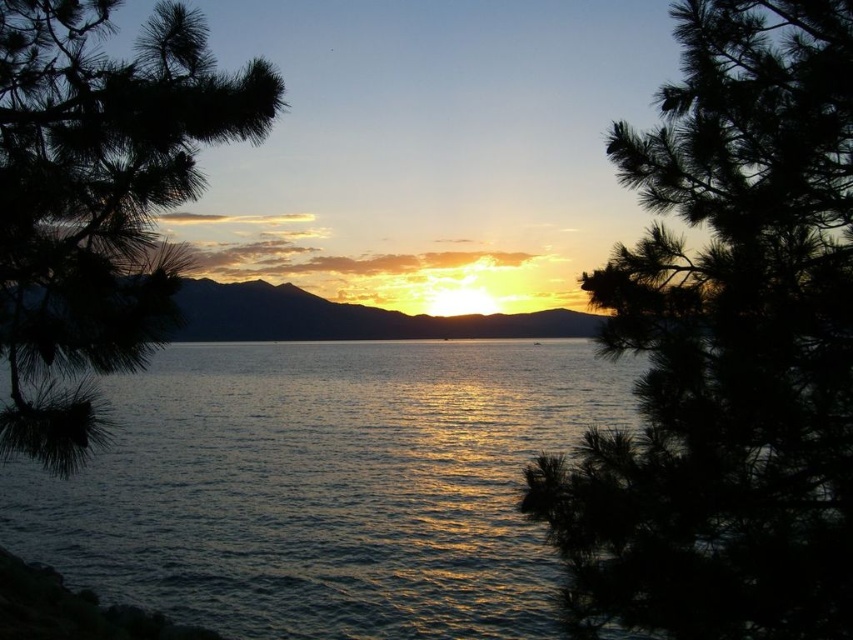
Question: Can you confirm if dark green pine tree at center is smaller than green matte pine branch at left?

Choices:
 (A) yes
 (B) no

Answer: (B)

Question: Based on their relative distances, which object is farther from the dark green pine tree at center?

Choices:
 (A) green matte pine branch at left
 (B) glistening silver water at center

Answer: (B)

Question: Can you confirm if dark green pine tree at center is bigger than glistening silver water at center?

Choices:
 (A) no
 (B) yes

Answer: (A)

Question: Is glistening silver water at center thinner than green matte pine branch at left?

Choices:
 (A) no
 (B) yes

Answer: (A)

Question: Based on their relative distances, which object is farther from the green matte pine branch at left?

Choices:
 (A) glistening silver water at center
 (B) dark green pine tree at center

Answer: (A)

Question: Among these points, which one is nearest to the camera?

Choices:
 (A) (115, 289)
 (B) (171, 440)
 (C) (643, 472)

Answer: (A)